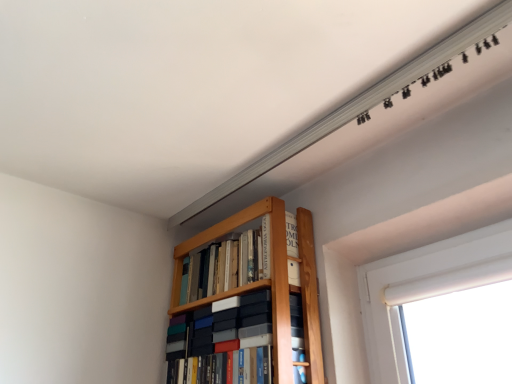
Question: Considering the relative positions of matte black book at center, the 1th book in the bottom-to-top sequence, and wooden bookshelf at upper center, marked as the 1th book in a top-to-bottom arrangement, in the image provided, is matte black book at center, the 1th book in the bottom-to-top sequence, to the left of wooden bookshelf at upper center, marked as the 1th book in a top-to-bottom arrangement, from the viewer's perspective?

Choices:
 (A) yes
 (B) no

Answer: (A)

Question: From a real-world perspective, is matte black book at center, the 2th book when ordered from top to bottom, located higher than wooden bookshelf at upper center, marked as the 1th book in a top-to-bottom arrangement?

Choices:
 (A) yes
 (B) no

Answer: (B)

Question: Can you confirm if matte black book at center, the 1th book in the bottom-to-top sequence, is wider than wooden bookshelf at upper center, which is the 2th book in bottom-to-top order?

Choices:
 (A) yes
 (B) no

Answer: (A)

Question: From the image's perspective, does matte black book at center, the 1th book in the bottom-to-top sequence, appear higher than wooden bookshelf at upper center, which is the 2th book in bottom-to-top order?

Choices:
 (A) yes
 (B) no

Answer: (B)

Question: From the image's perspective, is matte black book at center, the 1th book in the bottom-to-top sequence, beneath wooden bookshelf at upper center, which is the 2th book in bottom-to-top order?

Choices:
 (A) no
 (B) yes

Answer: (B)

Question: Is wooden bookshelf at upper center, which is the 2th book in bottom-to-top order, inside matte black book at center, the 2th book when ordered from top to bottom?

Choices:
 (A) yes
 (B) no

Answer: (B)

Question: Considering the relative sizes of wooden bookshelf at upper center, which is the 2th book in bottom-to-top order, and matte black book at center, the 2th book when ordered from top to bottom, in the image provided, is wooden bookshelf at upper center, which is the 2th book in bottom-to-top order, smaller than matte black book at center, the 2th book when ordered from top to bottom,?

Choices:
 (A) no
 (B) yes

Answer: (B)

Question: Is the depth of wooden bookshelf at upper center, which is the 2th book in bottom-to-top order, less than that of matte black book at center, the 2th book when ordered from top to bottom?

Choices:
 (A) no
 (B) yes

Answer: (A)

Question: From a real-world perspective, is wooden bookshelf at upper center, marked as the 1th book in a top-to-bottom arrangement, positioned over matte black book at center, the 1th book in the bottom-to-top sequence, based on gravity?

Choices:
 (A) no
 (B) yes

Answer: (B)

Question: From a real-world perspective, is wooden bookshelf at upper center, marked as the 1th book in a top-to-bottom arrangement, positioned under matte black book at center, the 1th book in the bottom-to-top sequence, based on gravity?

Choices:
 (A) yes
 (B) no

Answer: (B)

Question: Considering the relative sizes of wooden bookshelf at upper center, marked as the 1th book in a top-to-bottom arrangement, and matte black book at center, the 2th book when ordered from top to bottom, in the image provided, is wooden bookshelf at upper center, marked as the 1th book in a top-to-bottom arrangement, taller than matte black book at center, the 2th book when ordered from top to bottom,?

Choices:
 (A) yes
 (B) no

Answer: (B)

Question: Is wooden bookshelf at upper center, which is the 2th book in bottom-to-top order, looking in the opposite direction of matte black book at center, the 2th book when ordered from top to bottom?

Choices:
 (A) yes
 (B) no

Answer: (B)

Question: Is wooden bookshelf at upper center, marked as the 1th book in a top-to-bottom arrangement, spatially inside matte black book at center, the 2th book when ordered from top to bottom, or outside of it?

Choices:
 (A) outside
 (B) inside

Answer: (A)